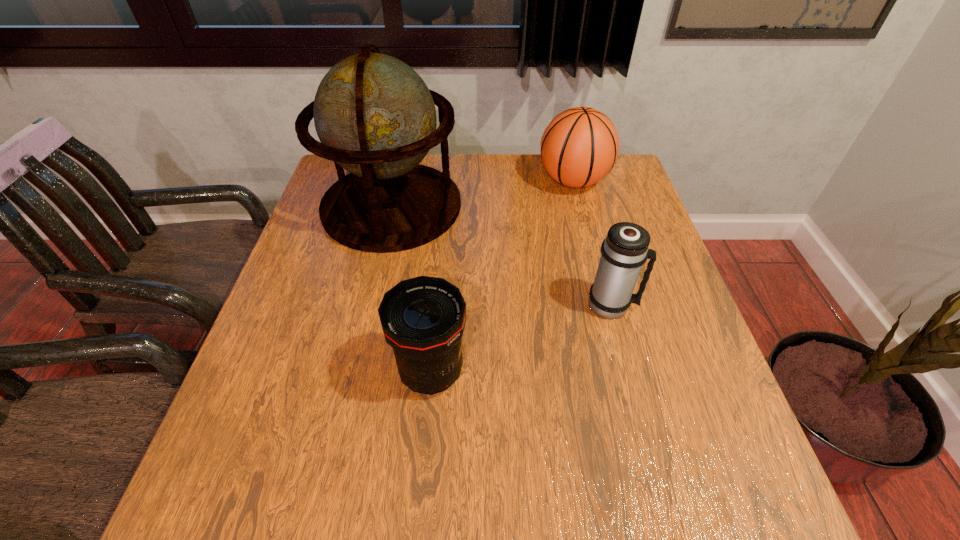
This screenshot has width=960, height=540. In order to click on basketball that is positioned at the right edge in this screenshot , I will do `click(579, 147)`.

This screenshot has width=960, height=540. In order to click on thermos bottle that is at the right edge in this screenshot , I will do `click(625, 249)`.

Find the location of a particular element. object at the far left corner is located at coordinates [x=375, y=117].

Where is `object located in the far right corner section of the desktop`? The image size is (960, 540). object located in the far right corner section of the desktop is located at coordinates (579, 147).

The image size is (960, 540). Identify the location of vacant region at the far edge of the desktop. (462, 158).

At what (x,y) coordinates should I click in order to perform the action: click on vacant position at the near edge of the desktop. Please return your answer as a coordinate pair (x, y). This screenshot has width=960, height=540. Looking at the image, I should click on (656, 475).

I want to click on vacant region at the left edge of the desktop, so click(x=262, y=374).

What are the coordinates of `free space at the right edge` in the screenshot? It's located at (642, 412).

The height and width of the screenshot is (540, 960). Find the location of `vacant area at the near left corner of the desktop`. vacant area at the near left corner of the desktop is located at coordinates (240, 478).

Find the location of `blank region between the nearest object and the basketball`. blank region between the nearest object and the basketball is located at coordinates (502, 276).